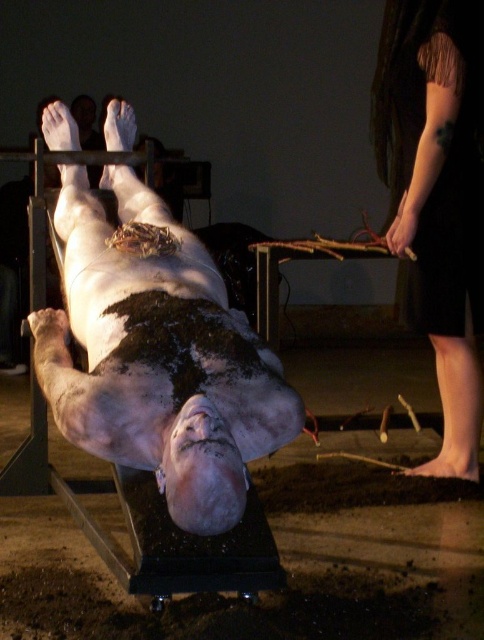
Based on the scene description, where is the white matte human at center located in terms of coordinates?

The white matte human at center is located at point (157,355).

You are an art curator examining the installation. You need to determine the spatial relationship between the white matte human at center and the dark fabric dress at right. Which object is positioned closer to the observer?

The white matte human at center is closer to the viewer than the dark fabric dress at right.

You are an event organizer planning a photoshoot in this setting. You need to position a small camera on a tripod that must be placed near either the white matte human at center or the dark fabric dress at right. Considering their sizes, which object should the camera be placed closer to to ensure it fits within the frame without overcrowding?

The white matte human at center has a larger size compared to the dark fabric dress at right. To avoid overcrowding the frame, the camera should be placed closer to the dark fabric dress at right since it is smaller and requires less space in the composition.